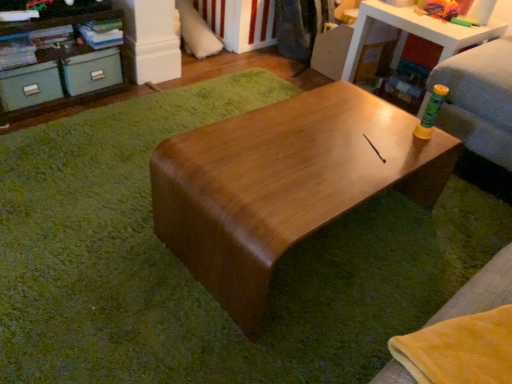
Where is `free location to the right of matte green drawer at left, the 1th drawer from the right`? This screenshot has height=384, width=512. free location to the right of matte green drawer at left, the 1th drawer from the right is located at coordinates (135, 98).